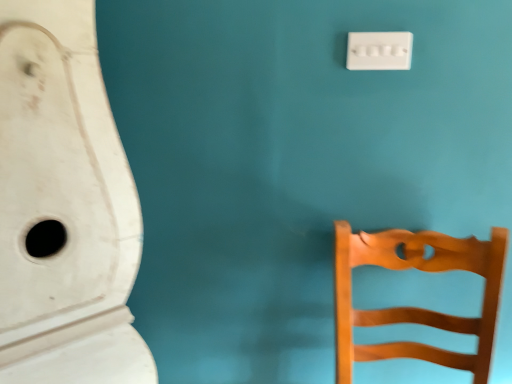
The width and height of the screenshot is (512, 384). Find the location of `wooden chair at right`. wooden chair at right is located at coordinates (413, 307).

Describe the element at coordinates (413, 307) in the screenshot. I see `wooden chair at right` at that location.

The image size is (512, 384). I want to click on white matte urinal at left, so click(64, 206).

Would you say white matte urinal at left is a long distance from wooden chair at right?

No, white matte urinal at left is in close proximity to wooden chair at right.

From a real-world perspective, which object rests below the other?

wooden chair at right is physically lower.

From the image's perspective, between white matte urinal at left and wooden chair at right, who is located below?

wooden chair at right.

Visually, is white matte urinal at left positioned to the left or to the right of wooden chair at right?

In the image, white matte urinal at left appears on the left side of wooden chair at right.

From a real-world perspective, is white plastic light switch at upper right above or below wooden chair at right?

In terms of real-world spatial position, white plastic light switch at upper right is above wooden chair at right.

Which is more to the right, white plastic light switch at upper right or wooden chair at right?

wooden chair at right.

Is white plastic light switch at upper right aimed at wooden chair at right?

No, white plastic light switch at upper right does not turn towards wooden chair at right.

From the image's perspective, is wooden chair at right above or below white matte urinal at left?

From the image's perspective, wooden chair at right appears below white matte urinal at left.

Which object is further away from the camera taking this photo, wooden chair at right or white matte urinal at left?

wooden chair at right is further away from the camera.

How distant is wooden chair at right from white matte urinal at left?

wooden chair at right and white matte urinal at left are 26.46 inches apart from each other.

Is wooden chair at right placed right next to white matte urinal at left?

They are not placed beside each other.

From the image's perspective, which one is positioned lower, white matte urinal at left or white plastic light switch at upper right?

From the image's view, white matte urinal at left is below.

Which point is more forward, (87, 31) or (405, 36)?

The point (87, 31) is in front.

You are a GUI agent. You are given a task and a screenshot of the screen. Output one action in this format:
    pyautogui.click(x=<x>, y=<y>)
    Task: Click on the light switch located above the white matte urinal at left (from a real-world perspective)
    
    Given the screenshot: What is the action you would take?
    pyautogui.click(x=379, y=50)

In terms of size, does white matte urinal at left appear bigger or smaller than white plastic light switch at upper right?

Considering their sizes, white matte urinal at left takes up more space than white plastic light switch at upper right.

Which is correct: white plastic light switch at upper right is inside white matte urinal at left, or outside of it?

white plastic light switch at upper right lies outside white matte urinal at left.

How many degrees apart are the facing directions of white plastic light switch at upper right and white matte urinal at left?

90 degrees.

Which of these two, white plastic light switch at upper right or white matte urinal at left, is thinner?

Thinner between the two is white plastic light switch at upper right.

Considering the relative sizes of white plastic light switch at upper right and white matte urinal at left in the image provided, is white plastic light switch at upper right shorter than white matte urinal at left?

Indeed, white plastic light switch at upper right has a lesser height compared to white matte urinal at left.

Can you confirm if wooden chair at right is taller than white plastic light switch at upper right?

Correct, wooden chair at right is much taller as white plastic light switch at upper right.

Between wooden chair at right and white plastic light switch at upper right, which one is positioned behind?

white plastic light switch at upper right is further from the camera.

Does wooden chair at right turn towards white plastic light switch at upper right?

No, wooden chair at right is not turned towards white plastic light switch at upper right.

From a real-world perspective, between wooden chair at right and white plastic light switch at upper right, who is vertically higher?

white plastic light switch at upper right, from a real-world perspective.

Image resolution: width=512 pixels, height=384 pixels. Find the location of `urinal in front of the wooden chair at right`. urinal in front of the wooden chair at right is located at coordinates (64, 206).

You are a GUI agent. You are given a task and a screenshot of the screen. Output one action in this format:
    pyautogui.click(x=<x>, y=<y>)
    Task: Click on the furniture below the white plastic light switch at upper right (from a real-world perspective)
    The width and height of the screenshot is (512, 384).
    Given the screenshot: What is the action you would take?
    pyautogui.click(x=413, y=307)

From the picture: From the image, which object appears to be farther from white matte urinal at left, wooden chair at right or white plastic light switch at upper right?

white plastic light switch at upper right is further to white matte urinal at left.

Looking at the image, which one is located further to white matte urinal at left, white plastic light switch at upper right or wooden chair at right?

white plastic light switch at upper right is further to white matte urinal at left.

Considering their positions, is white plastic light switch at upper right positioned closer to wooden chair at right than white matte urinal at left?

white plastic light switch at upper right is closer to wooden chair at right.

Looking at the image, which one is located further to white plastic light switch at upper right, wooden chair at right or white matte urinal at left?

Based on the image, white matte urinal at left appears to be further to white plastic light switch at upper right.

When comparing their distances from white plastic light switch at upper right, does white matte urinal at left or wooden chair at right seem further?

The object further to white plastic light switch at upper right is white matte urinal at left.

Based on their spatial positions, is white matte urinal at left or white plastic light switch at upper right further from wooden chair at right?

The object further to wooden chair at right is white matte urinal at left.

What are the coordinates of `light switch between white matte urinal at left and wooden chair at right from left to right` in the screenshot? It's located at (379, 50).